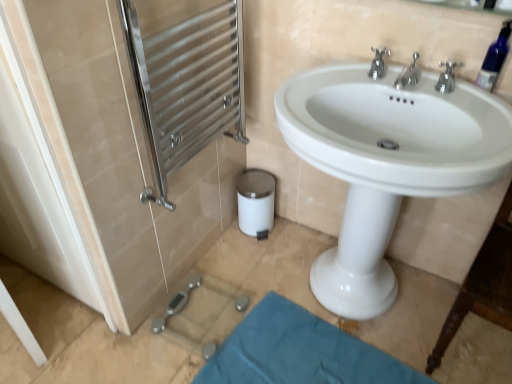
Identify the location of vacant area that lies to the right of polished chrome faucet at upper center, which appears as the 2th tap when viewed from the right. (446, 100).